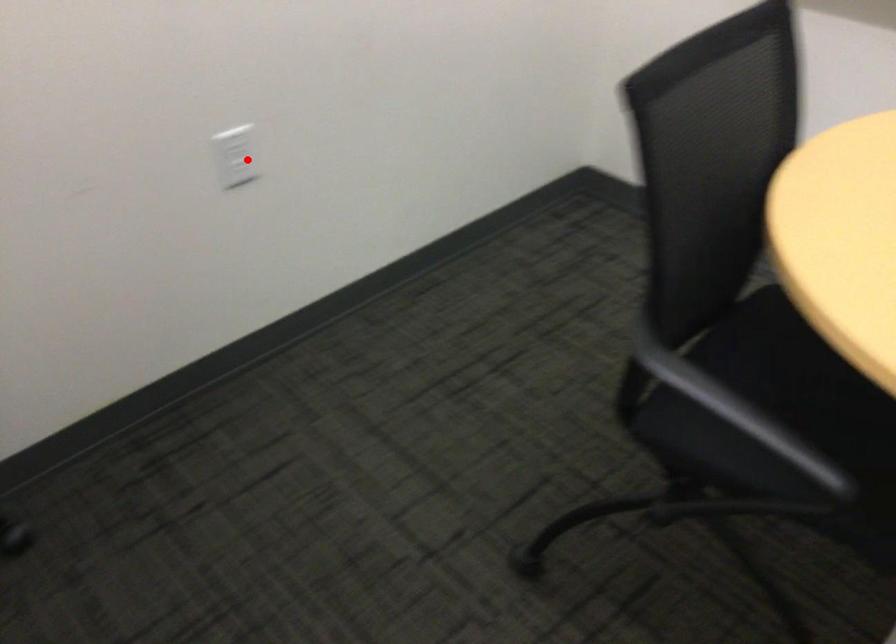
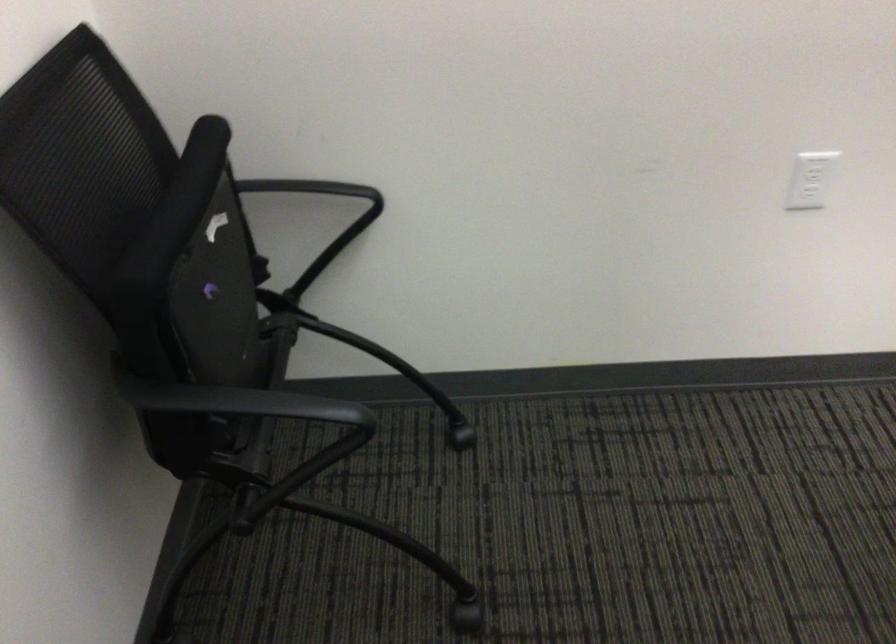
The point at the highlighted location is marked in the first image. Where is the corresponding point in the second image?

(810, 180)